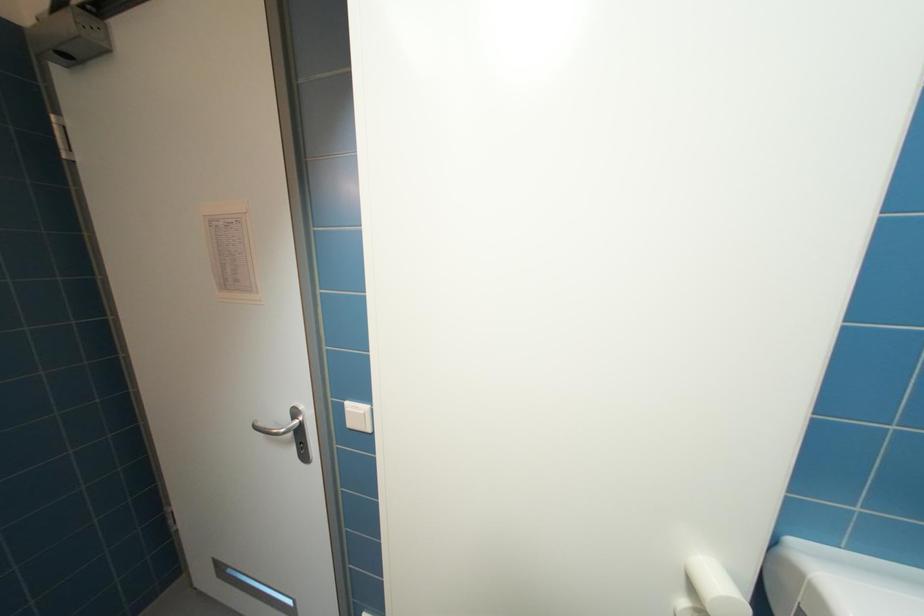
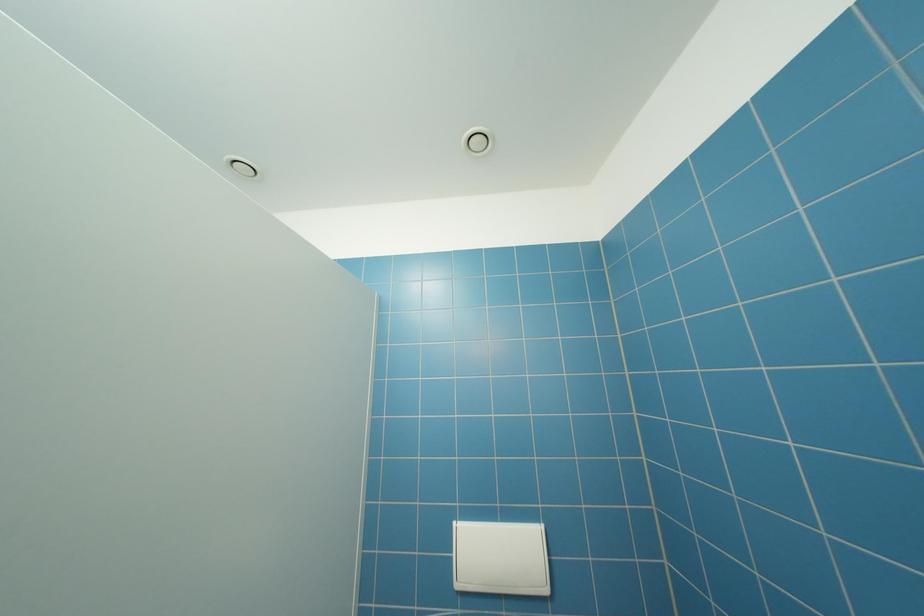
Question: The first image is from the beginning of the video and the second image is from the end. How did the camera likely rotate when shooting the video?

Choices:
 (A) Left
 (B) Right
 (C) Up
 (D) Down

Answer: (B)